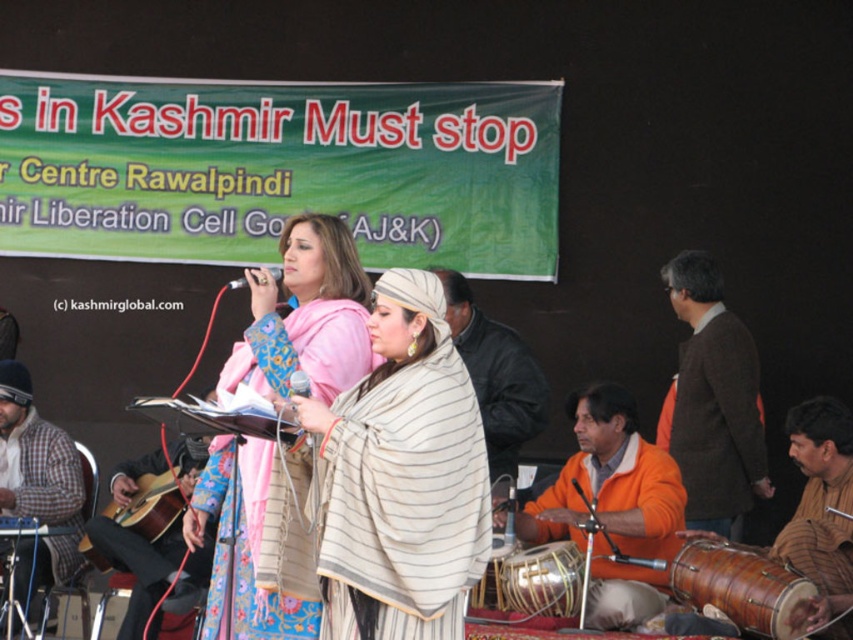
Question: Considering the real-world distances, which object is farthest from the orange cotton tunic at lower right?

Choices:
 (A) black leather jacket at center
 (B) wooden drum at center

Answer: (A)

Question: Can you confirm if wooden drum at center is positioned above metallic shiny microphone at upper center?

Choices:
 (A) no
 (B) yes

Answer: (A)

Question: Considering the relative positions of matte pink dress at center and black leather jacket at center in the image provided, where is matte pink dress at center located with respect to black leather jacket at center?

Choices:
 (A) right
 (B) left

Answer: (B)

Question: Does orange cotton tunic at lower right have a greater width compared to metallic shiny microphone at upper center?

Choices:
 (A) yes
 (B) no

Answer: (A)

Question: Which of the following is the farthest from the observer?

Choices:
 (A) (614, 564)
 (B) (543, 604)
 (C) (115, 515)
 (D) (351, 593)

Answer: (C)

Question: Which point is closer to the camera?

Choices:
 (A) brown woolen sweater at right
 (B) brown textured drum at lower right
 (C) wooden drum at center

Answer: (B)